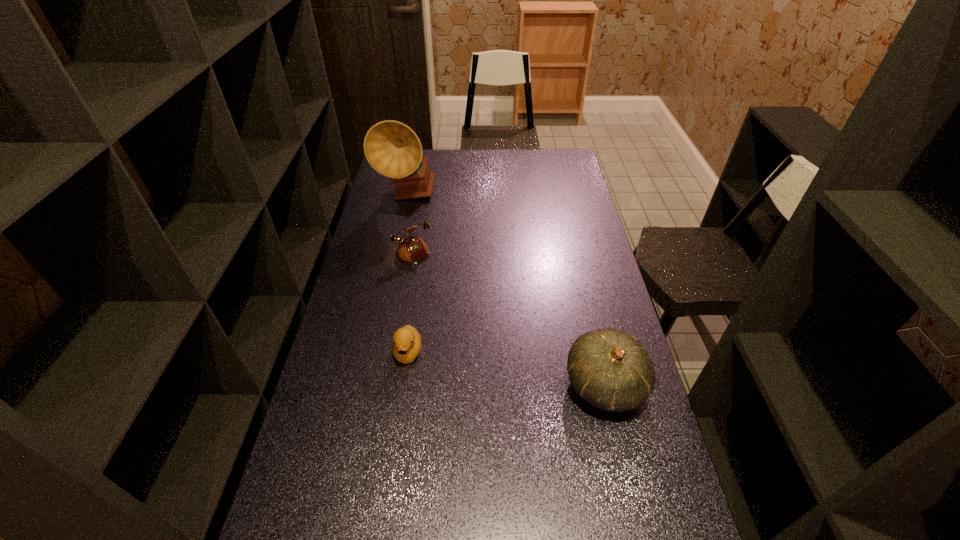
This screenshot has width=960, height=540. In order to click on vacant space on the desktop that is between the duckling and the rightmost object and is positioned on the rotary dial of the telephone in this screenshot , I will do `click(480, 364)`.

You are a GUI agent. You are given a task and a screenshot of the screen. Output one action in this format:
    pyautogui.click(x=<x>, y=<y>)
    Task: Click on the free spot on the desktop that is between the duckling and the second tallest object and is positioned on the horn of the phonograph record
    
    Given the screenshot: What is the action you would take?
    coord(531,373)